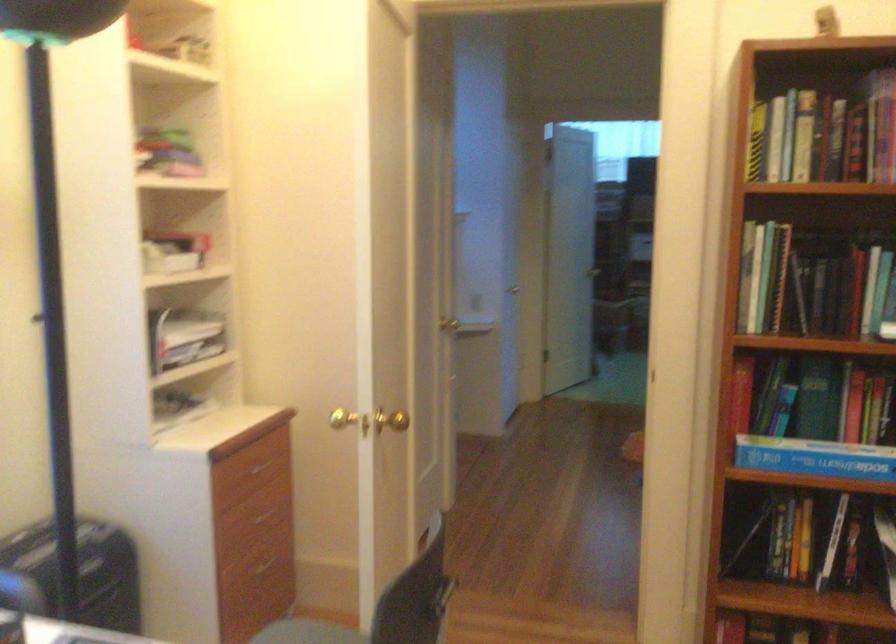
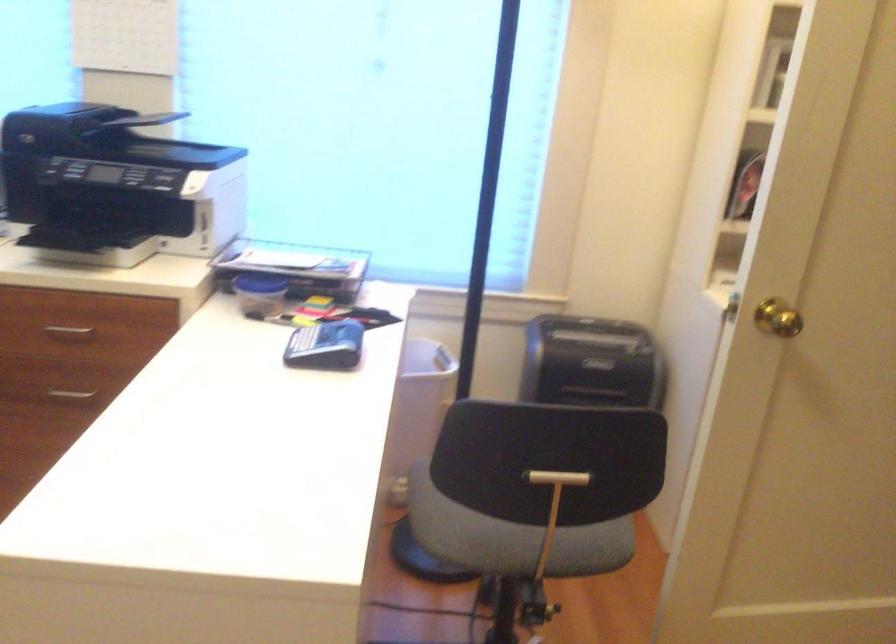
Find the pixel in the second image that matches the point at 89,574 in the first image.

(590, 363)